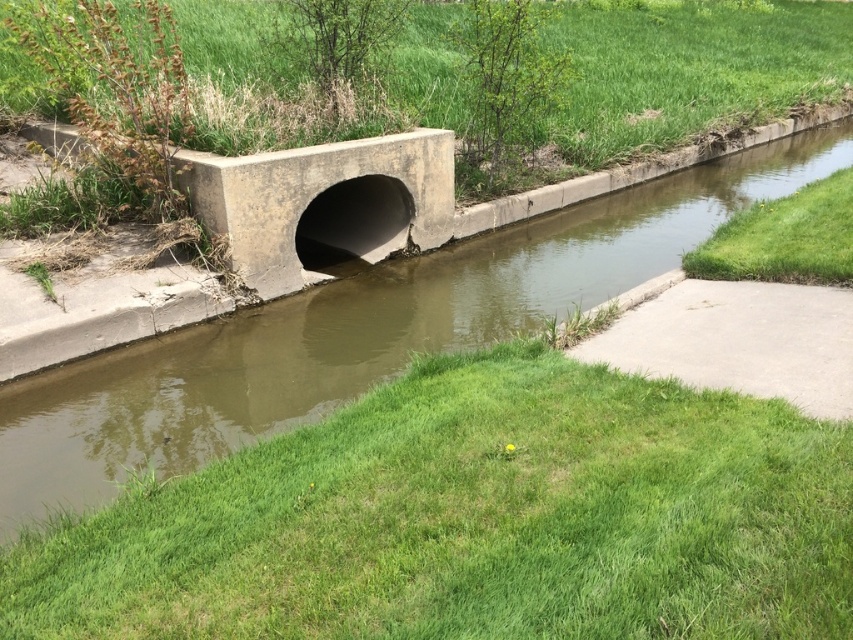
Does gray concrete at lower right have a greater width compared to green grass at lower right?

Correct, the width of gray concrete at lower right exceeds that of green grass at lower right.

Is gray concrete at lower right closer to camera compared to green grass at lower right?

Yes, gray concrete at lower right is closer to the viewer.

Is point (793, 376) less distant than point (805, 244)?

Yes.

Identify the location of gray concrete at lower right. This screenshot has height=640, width=853. (734, 339).

This screenshot has height=640, width=853. What do you see at coordinates (473, 518) in the screenshot?
I see `green grass at lower center` at bounding box center [473, 518].

Who is more forward, (x=468, y=456) or (x=767, y=276)?

Positioned in front is point (x=468, y=456).

Find the location of a particular element. The image size is (853, 640). green grass at lower center is located at coordinates (473, 518).

The height and width of the screenshot is (640, 853). I want to click on green grass at lower center, so click(x=473, y=518).

Can you confirm if brown concrete stream at center is positioned above gray concrete at lower right?

Correct, brown concrete stream at center is located above gray concrete at lower right.

Between point (91, 497) and point (775, 291), which one is positioned behind?

Point (775, 291)

Locate an element on the screen. brown concrete stream at center is located at coordinates (358, 332).

Image resolution: width=853 pixels, height=640 pixels. I want to click on brown concrete stream at center, so click(x=358, y=332).